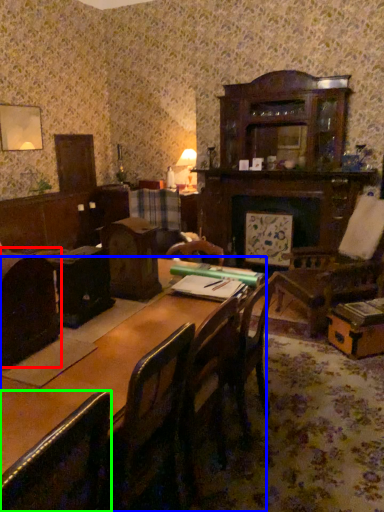
Question: Which is nearer to the chair (highlighted by a red box)? table (highlighted by a blue box) or chair (highlighted by a green box).

Choices:
 (A) table
 (B) chair

Answer: (A)